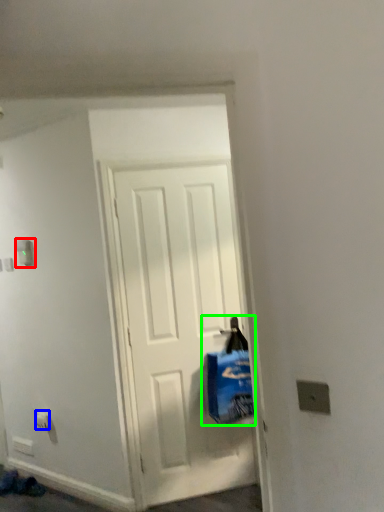
Question: Which is nearer to the light switch (highlighted by a red box)? electric outlet (highlighted by a blue box) or shopping bag (highlighted by a green box).

Choices:
 (A) electric outlet
 (B) shopping bag

Answer: (A)